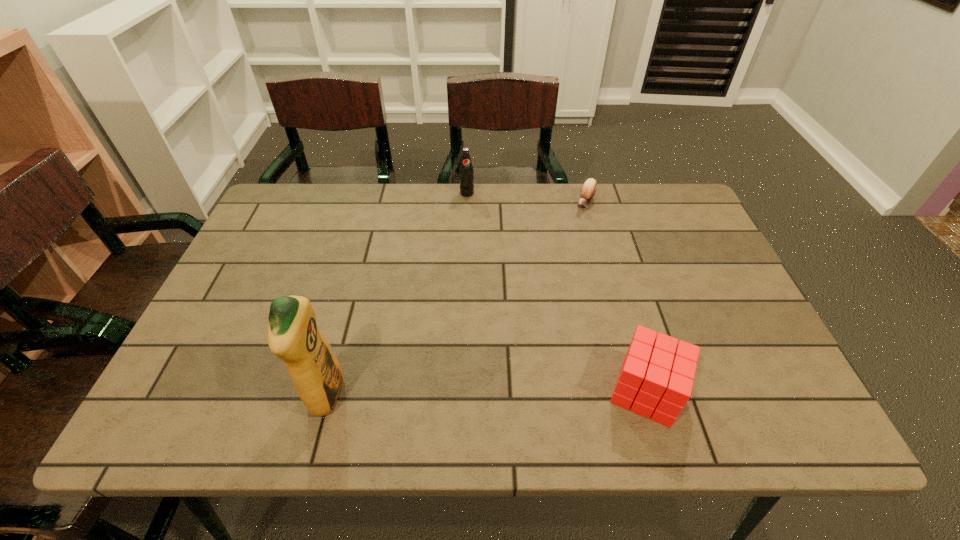
Locate an element on the screen. The image size is (960, 540). vacant space at the near left corner of the desktop is located at coordinates (250, 366).

This screenshot has height=540, width=960. In order to click on vacant region at the far right corner of the desktop in this screenshot , I will do `click(650, 185)`.

Find the location of `free point between the escargot and the leftmost object`. free point between the escargot and the leftmost object is located at coordinates tap(455, 299).

You are a GUI agent. You are given a task and a screenshot of the screen. Output one action in this format:
    pyautogui.click(x=<x>, y=<y>)
    Task: Click on the free space that is in between the second shortest object and the third shortest object
    
    Given the screenshot: What is the action you would take?
    pyautogui.click(x=557, y=292)

At what (x,y) coordinates should I click in order to perform the action: click on free spot between the detergent and the second object from left to right. Please return your answer as a coordinate pair (x, y). The width and height of the screenshot is (960, 540). Looking at the image, I should click on (396, 294).

This screenshot has height=540, width=960. What are the coordinates of `vacant space that's between the third shortest object and the second shortest object` in the screenshot? It's located at (557, 292).

You are a GUI agent. You are given a task and a screenshot of the screen. Output one action in this format:
    pyautogui.click(x=<x>, y=<y>)
    Task: Click on the empty location between the tallest object and the shortest object
    The image size is (960, 540).
    Given the screenshot: What is the action you would take?
    pyautogui.click(x=455, y=299)

This screenshot has width=960, height=540. What are the coordinates of `free spot between the leftmost object and the third tallest object` in the screenshot? It's located at (486, 393).

The height and width of the screenshot is (540, 960). I want to click on free space that is in between the second object from left to right and the escargot, so click(526, 198).

Image resolution: width=960 pixels, height=540 pixels. In order to click on vacant space that is in between the third tallest object and the third shortest object in this screenshot , I will do `click(557, 292)`.